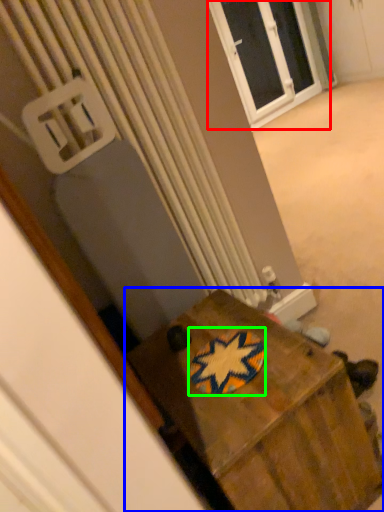
Question: Which object is the closest to the window (highlighted by a red box)? Choose among these: furniture (highlighted by a blue box) or design (highlighted by a green box).

Choices:
 (A) furniture
 (B) design

Answer: (A)